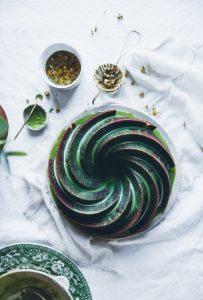
The image size is (203, 300). I want to click on tiny white bowl, so click(109, 88).